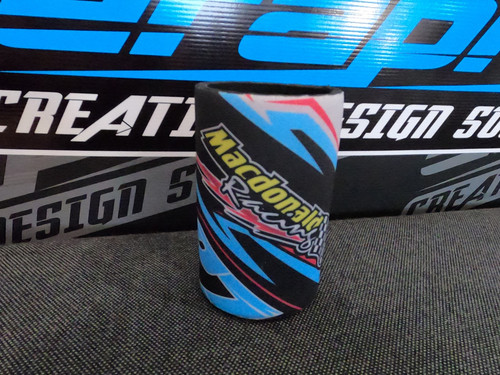
Locate an element on the screen. The image size is (500, 375). foam is located at coordinates (261, 163).